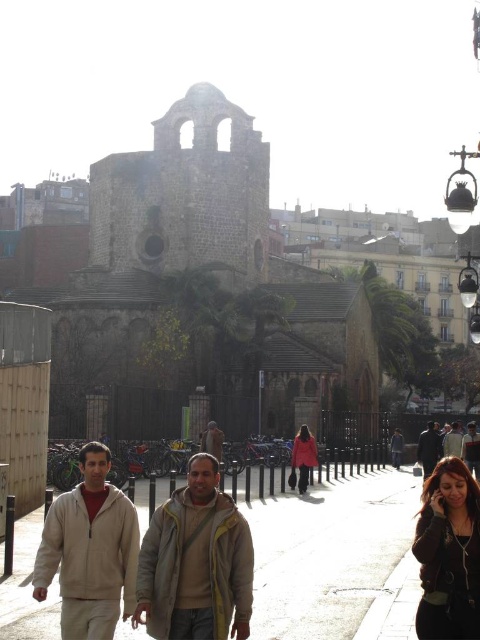
Question: In this image, where is beige woolen jacket at center located relative to matte black coat at center?

Choices:
 (A) right
 (B) left

Answer: (B)

Question: Does beige woolen jacket at center lie in front of matte beige sweater at lower right?

Choices:
 (A) yes
 (B) no

Answer: (A)

Question: Does dark brown leather jacket at lower right appear on the left side of matte black coat at center?

Choices:
 (A) yes
 (B) no

Answer: (B)

Question: Which object is farther from the camera taking this photo?

Choices:
 (A) light beige fleece jacket at lower left
 (B) matte pink coat at center

Answer: (B)

Question: Which object is positioned farthest from the shiny brown hair at lower right?

Choices:
 (A) light brown leather jacket at center
 (B) beige woolen jacket at center

Answer: (A)

Question: Which object is positioned closest to the matte beige sweater at lower right?

Choices:
 (A) smooth concrete pavement at lower center
 (B) light beige fleece jacket at lower left
 (C) dark brown leather jacket at lower right

Answer: (C)